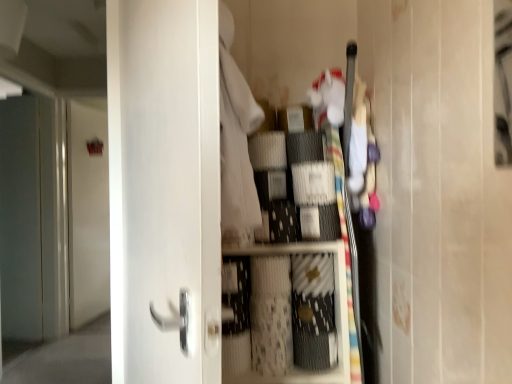
Question: Do you think white matte door at upper left, the second door from the front, is within white matte drawer at center, or outside of it?

Choices:
 (A) outside
 (B) inside

Answer: (A)

Question: Is white matte door at upper left, the 2th door from the right, wider or thinner than white matte drawer at center?

Choices:
 (A) thin
 (B) wide

Answer: (A)

Question: Based on their relative distances, which object is nearer to the matte gray screen door at left?

Choices:
 (A) white matte drawer at center
 (B) white matte door at upper left, which is the 1th door in back-to-front order
 (C) white glossy door at center, which is counted as the second door, starting from the back

Answer: (B)

Question: Which of these objects is positioned closest to the white glossy door at center, which is counted as the 2th door, starting from the left?

Choices:
 (A) matte gray screen door at left
 (B) white matte drawer at center
 (C) white matte door at upper left, the 2th door from the right

Answer: (B)